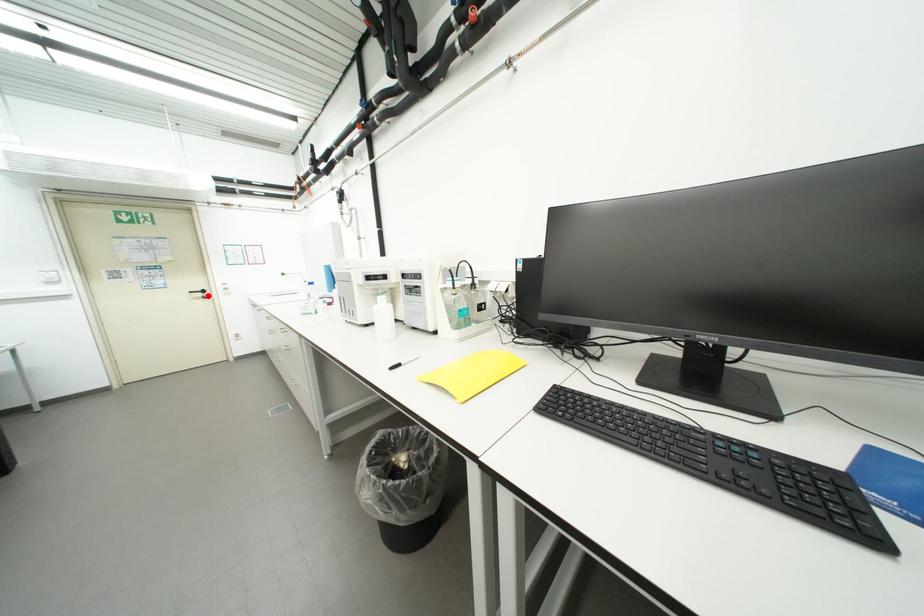
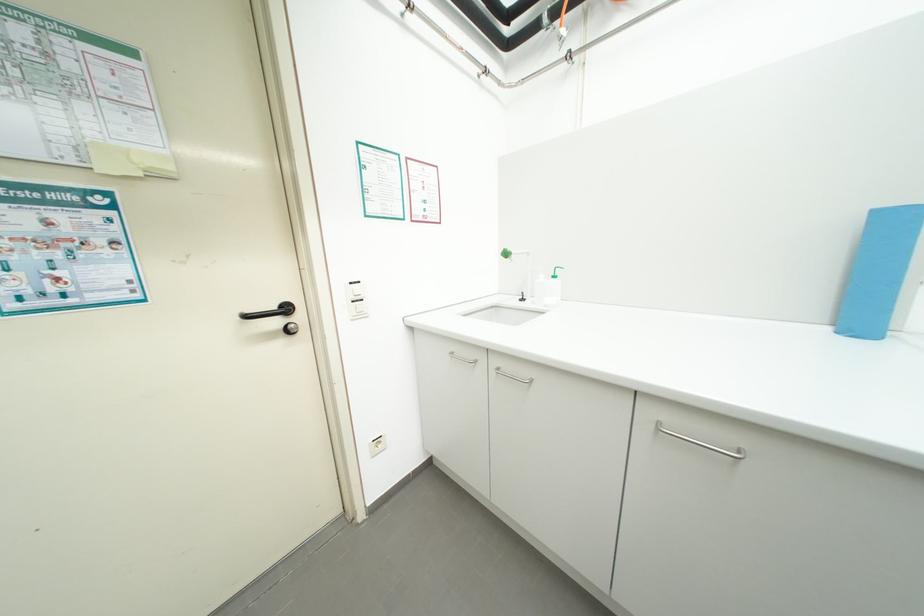
Where in the second image is the point corresponding to the highlighted location from the first image?

(285, 323)